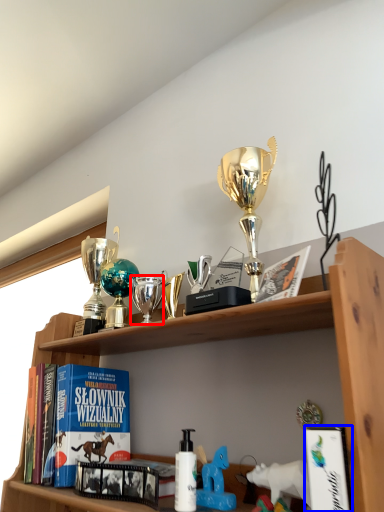
Question: Among these objects, which one is farthest to the camera, toy (highlighted by a red box) or book (highlighted by a blue box)?

Choices:
 (A) toy
 (B) book

Answer: (A)